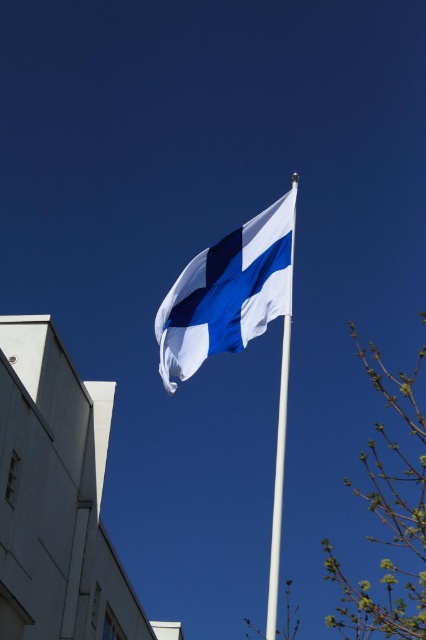
Is white fabric flag at center smaller than white metallic pole at center?

Yes, white fabric flag at center is smaller than white metallic pole at center.

Can you confirm if white fabric flag at center is bigger than white metallic pole at center?

No.

In the scene shown: Who is more forward, (x=273, y=253) or (x=279, y=436)?

Point (x=279, y=436) is in front.

What are the coordinates of `white fabric flag at center` in the screenshot? It's located at (227, 292).